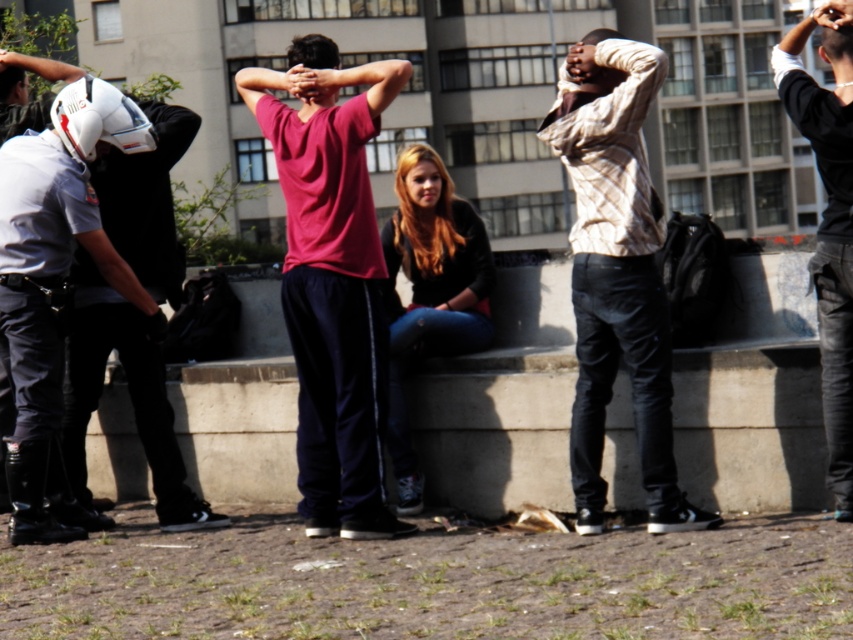
Between light brown plaid shirt at center and dark brown leather jacket at center, which one appears on the right side from the viewer's perspective?

light brown plaid shirt at center is more to the right.

This screenshot has height=640, width=853. What do you see at coordinates (616, 273) in the screenshot?
I see `light brown plaid shirt at center` at bounding box center [616, 273].

Find the location of a particular element. light brown plaid shirt at center is located at coordinates (616, 273).

Between matte pink t-shirt at center and black leather jacket at right, which one has more height?

black leather jacket at right is taller.

Between point (364, 307) and point (848, 176), which one is positioned behind?

The point (364, 307) is more distant.

At what (x,y) coordinates should I click in order to perform the action: click on matte pink t-shirt at center. Please return your answer as a coordinate pair (x, y). The image size is (853, 640). Looking at the image, I should click on (332, 280).

Which is more to the right, white matte helmet at left or dark brown leather jacket at center?

From the viewer's perspective, dark brown leather jacket at center appears more on the right side.

Can you confirm if white matte helmet at left is positioned below dark brown leather jacket at center?

Correct, white matte helmet at left is located below dark brown leather jacket at center.

At what (x,y) coordinates should I click in order to perform the action: click on white matte helmet at left. Please return your answer as a coordinate pair (x, y). The height and width of the screenshot is (640, 853). Looking at the image, I should click on (51, 202).